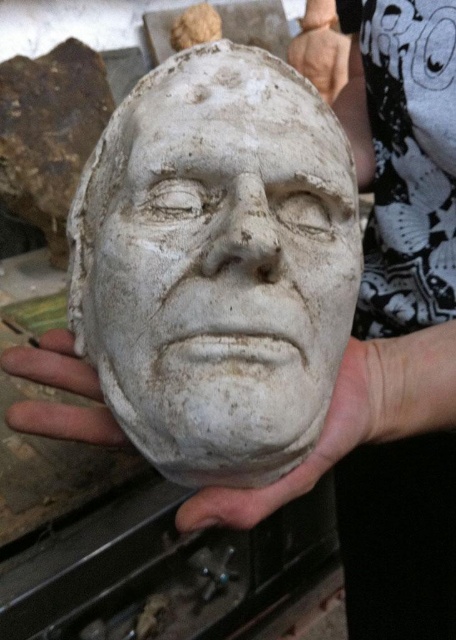
Between white clay mask at center and white matte hand at center, which one is positioned lower?

white matte hand at center is below.

Describe the element at coordinates (218, 259) in the screenshot. The height and width of the screenshot is (640, 456). I see `white clay mask at center` at that location.

Which is in front, point (265, 305) or point (295, 467)?

Point (265, 305)

Where is `white clay mask at center`? The height and width of the screenshot is (640, 456). white clay mask at center is located at coordinates (218, 259).

Can you confirm if white matte hand at center is wider than gray matte hand at lower left?

Yes.

Find the location of a particular element. white matte hand at center is located at coordinates (309, 454).

Identify the location of white matte hand at center. (309, 454).

Where is `white clay mask at center`? white clay mask at center is located at coordinates (218, 259).

Which is more to the left, white clay mask at center or gray matte hand at lower left?

gray matte hand at lower left is more to the left.

Is point (322, 104) positioned before point (48, 410)?

That is False.

You are a GUI agent. You are given a task and a screenshot of the screen. Output one action in this format:
    pyautogui.click(x=<x>, y=<y>)
    Task: Click on the white clay mask at center
    
    Given the screenshot: What is the action you would take?
    pyautogui.click(x=218, y=259)